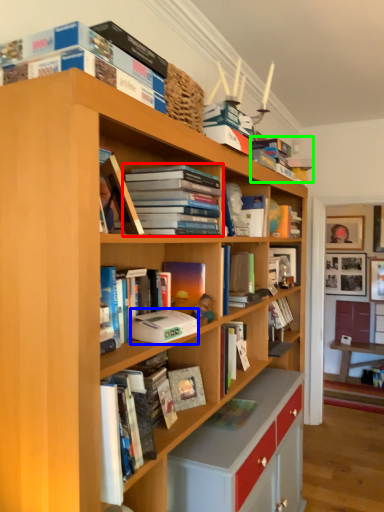
Question: Which object is the farthest from book (highlighted by a red box)? Choose among these: paperback book (highlighted by a blue box) or book (highlighted by a green box).

Choices:
 (A) paperback book
 (B) book

Answer: (B)